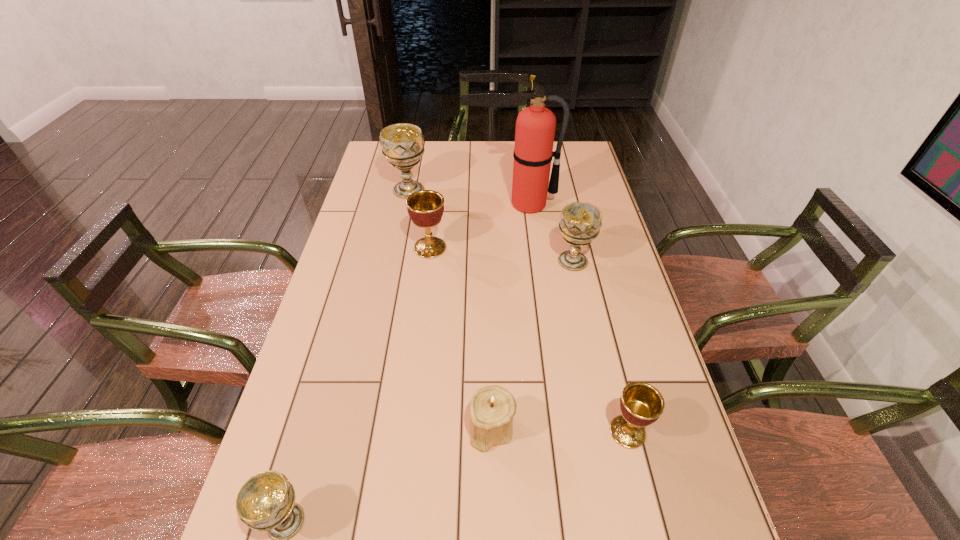
At what (x,y) coordinates should I click in order to perform the action: click on vacant space that satisfies the following two spatial constraints: 1. on the back side of the candle_holder; 2. on the right side of the rightmost white chalice. Please return your answer as a coordinate pair (x, y). Looking at the image, I should click on (489, 261).